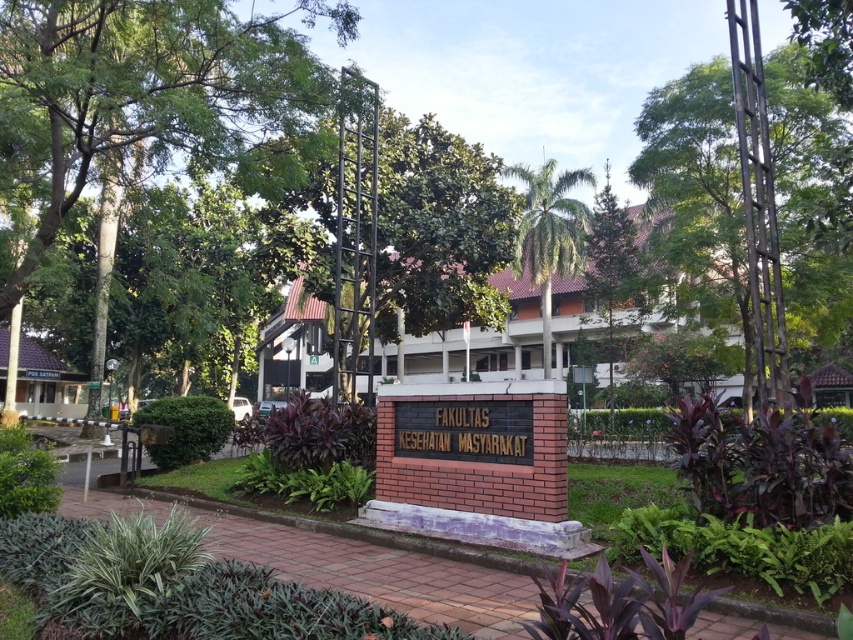
Who is more distant from viewer, (527, 285) or (556, 177)?

Point (527, 285)

Between point (502, 374) and point (546, 241), which one is positioned in front?

Point (546, 241)

Is point (511, 365) farther from viewer compared to point (529, 168)?

Yes, it is.

Identify the location of brown brick building at center. (509, 333).

The width and height of the screenshot is (853, 640). Describe the element at coordinates (141, 96) in the screenshot. I see `green leafy tree at upper left` at that location.

Is green leafy tree at upper left taller than green leafy tree at center?

A: No.

The width and height of the screenshot is (853, 640). Describe the element at coordinates (141, 96) in the screenshot. I see `green leafy tree at upper left` at that location.

Identify the location of green leafy tree at upper left. (141, 96).

Is green leafy tree at upper right thinner than green leafy tree at center?

Indeed, green leafy tree at upper right has a lesser width compared to green leafy tree at center.

Between green leafy tree at upper right and green leafy tree at center, which one is positioned lower?

green leafy tree at center is below.

Which is behind, point (790, 211) or point (384, 236)?

Positioned behind is point (384, 236).

Locate an element on the screen. The image size is (853, 640). green leafy tree at upper right is located at coordinates (732, 186).